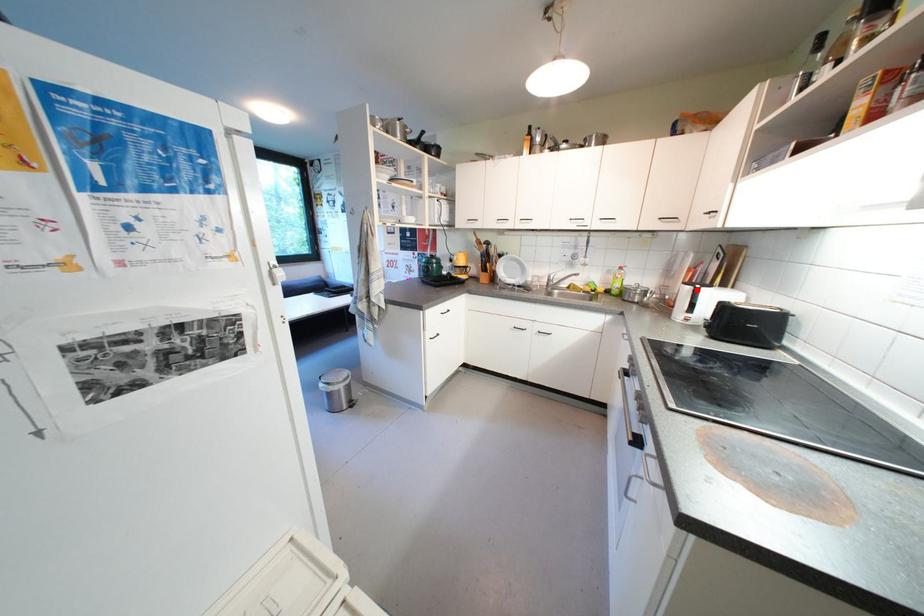
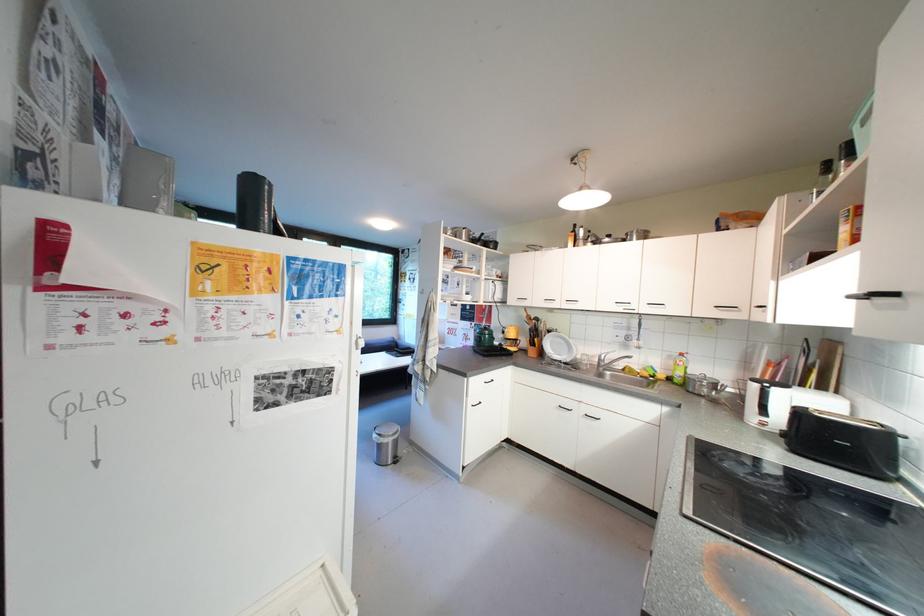
Question: I am providing you with two images of the same scene from different viewpoints. Image1 has a red point marked. In image2, the corresponding 3D location appears at what relative position? Reply with the corresponding letter.

Choices:
 (A) Closer
 (B) Farther

Answer: (B)